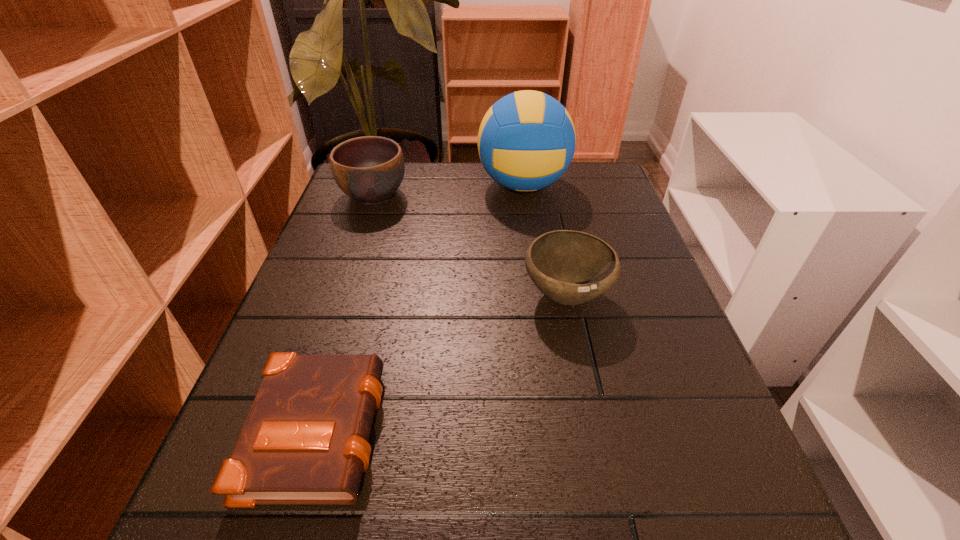
Locate an element on the screen. object present at the far right corner is located at coordinates (526, 141).

The height and width of the screenshot is (540, 960). Find the location of `free spot at the far edge of the desktop`. free spot at the far edge of the desktop is located at coordinates (473, 209).

Where is `free region at the left edge`? Image resolution: width=960 pixels, height=540 pixels. free region at the left edge is located at coordinates (347, 335).

This screenshot has width=960, height=540. I want to click on free space at the right edge of the desktop, so click(611, 222).

I want to click on free location at the far left corner of the desktop, so click(347, 201).

Identify the location of free point at the near left corner. The image size is (960, 540). (244, 526).

Image resolution: width=960 pixels, height=540 pixels. I want to click on free space at the far right corner, so click(x=587, y=184).

Identify the location of vacant area between the third tallest object and the nearest object. (443, 361).

Image resolution: width=960 pixels, height=540 pixels. What are the coordinates of `free spot between the Bible and the left bowl` in the screenshot? It's located at (347, 310).

Find the location of `vacant space that is in between the left bowl and the volleyball`. vacant space that is in between the left bowl and the volleyball is located at coordinates (448, 190).